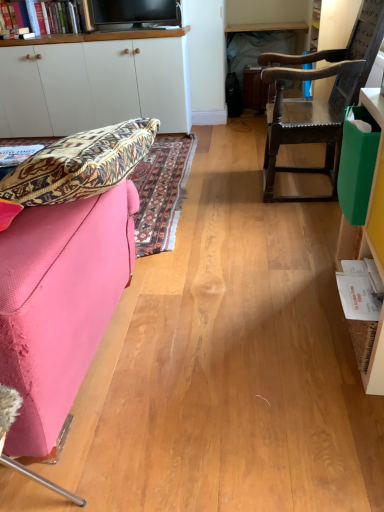
Question: Can you confirm if matte paper book at left, which is the first book from left to right, is wider than black glossy tv at upper center?

Choices:
 (A) no
 (B) yes

Answer: (B)

Question: Are matte paper book at left, placed as the second book when sorted from right to left, and black glossy tv at upper center beside each other?

Choices:
 (A) no
 (B) yes

Answer: (A)

Question: From a real-world perspective, is matte paper book at left, which is the first book from left to right, beneath black glossy tv at upper center?

Choices:
 (A) yes
 (B) no

Answer: (A)

Question: From a real-world perspective, is matte paper book at left, which is counted as the 1th book, starting from the back, on top of black glossy tv at upper center?

Choices:
 (A) yes
 (B) no

Answer: (B)

Question: Is matte paper book at left, placed as the second book when sorted from right to left, facing away from black glossy tv at upper center?

Choices:
 (A) no
 (B) yes

Answer: (A)

Question: Considering the positions of white paper book at right, which appears as the 2th book when viewed from the top, and black glossy tv at upper center in the image, is white paper book at right, which appears as the 2th book when viewed from the top, bigger or smaller than black glossy tv at upper center?

Choices:
 (A) small
 (B) big

Answer: (A)

Question: Does point (364, 309) appear closer or farther from the camera than point (140, 18)?

Choices:
 (A) farther
 (B) closer

Answer: (B)

Question: Considering the positions of white paper book at right, which is counted as the first book, starting from the right, and black glossy tv at upper center in the image, is white paper book at right, which is counted as the first book, starting from the right, taller or shorter than black glossy tv at upper center?

Choices:
 (A) tall
 (B) short

Answer: (B)

Question: In the image, is white paper book at right, which ranks as the 2th book in left-to-right order, positioned in front of or behind black glossy tv at upper center?

Choices:
 (A) front
 (B) behind

Answer: (A)

Question: Considering the positions of point (28, 148) and point (375, 117), is point (28, 148) closer or farther from the camera than point (375, 117)?

Choices:
 (A) farther
 (B) closer

Answer: (A)

Question: Considering the relative positions of matte paper book at left, the 2th book positioned from the bottom, and green plastic bag at right, arranged as the first cabinetry when viewed from the right, in the image provided, is matte paper book at left, the 2th book positioned from the bottom, to the left or to the right of green plastic bag at right, arranged as the first cabinetry when viewed from the right,?

Choices:
 (A) left
 (B) right

Answer: (A)

Question: Choose the correct answer: Is matte paper book at left, which appears as the second book when viewed from the front, inside green plastic bag at right, the 2th cabinetry when ordered from left to right, or outside it?

Choices:
 (A) inside
 (B) outside

Answer: (B)

Question: Considering the positions of matte paper book at left, which appears as the second book when viewed from the front, and green plastic bag at right, marked as the 2th cabinetry in a top-to-bottom arrangement, in the image, is matte paper book at left, which appears as the second book when viewed from the front, bigger or smaller than green plastic bag at right, marked as the 2th cabinetry in a top-to-bottom arrangement,?

Choices:
 (A) big
 (B) small

Answer: (B)

Question: Is green plastic bag at right, arranged as the first cabinetry when viewed from the right, spatially inside pink fabric couch at left, or outside of it?

Choices:
 (A) outside
 (B) inside

Answer: (A)

Question: From a real-world perspective, relative to pink fabric couch at left, is green plastic bag at right, marked as the 2th cabinetry in a top-to-bottom arrangement, vertically above or below?

Choices:
 (A) above
 (B) below

Answer: (A)